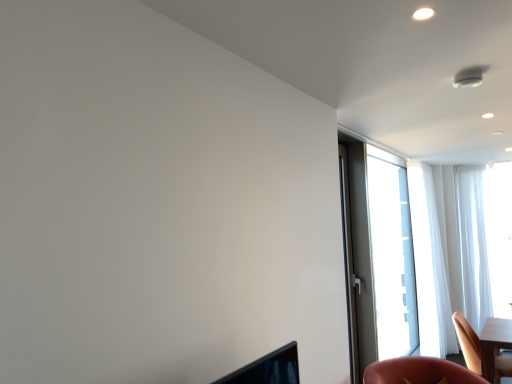
The height and width of the screenshot is (384, 512). Find the location of `wooden chair at lower right`. wooden chair at lower right is located at coordinates (468, 342).

Locate an element on the screen. The image size is (512, 384). white sheer curtain at right, which is the second curtain in right-to-left order is located at coordinates (434, 273).

In order to click on white sheer curtain at right, positioned as the second curtain in left-to-right order in this screenshot , I will do `click(473, 244)`.

From a real-world perspective, is white sheer curtain at right, which is the second curtain in right-to-left order, positioned under transparent glass window at right based on gravity?

Yes, from a real-world perspective, white sheer curtain at right, which is the second curtain in right-to-left order, is beneath transparent glass window at right.

From the picture: What's the angular difference between white sheer curtain at right, which is the second curtain in right-to-left order, and transparent glass window at right's facing directions?

5.79 degrees separate the facing orientations of white sheer curtain at right, which is the second curtain in right-to-left order, and transparent glass window at right.

From the image's perspective, between white sheer curtain at right, arranged as the first curtain when viewed from the left, and transparent glass window at right, which one is located above?

transparent glass window at right, from the image's perspective.

Is white sheer curtain at right, which is the second curtain in right-to-left order, spatially inside transparent glass window at right, or outside of it?

white sheer curtain at right, which is the second curtain in right-to-left order, cannot be found inside transparent glass window at right.

Is the depth of transparent glass window at right greater than that of white sheer curtain at right, arranged as the first curtain when viewed from the left?

No, it is not.

In terms of size, does transparent glass window at right appear bigger or smaller than white sheer curtain at right, arranged as the first curtain when viewed from the left?

Considering their sizes, transparent glass window at right takes up more space than white sheer curtain at right, arranged as the first curtain when viewed from the left.

Consider the image. Considering the relative sizes of transparent glass window at right and white sheer curtain at right, which is the second curtain in right-to-left order, in the image provided, is transparent glass window at right thinner than white sheer curtain at right, which is the second curtain in right-to-left order,?

Correct, the width of transparent glass window at right is less than that of white sheer curtain at right, which is the second curtain in right-to-left order.

Is matte gray screen door at right situated inside white sheer curtain at right, arranged as the first curtain when viewed from the left, or outside?

matte gray screen door at right is spatially situated outside white sheer curtain at right, arranged as the first curtain when viewed from the left.

Between matte gray screen door at right and white sheer curtain at right, arranged as the first curtain when viewed from the left, which one has larger size?

white sheer curtain at right, arranged as the first curtain when viewed from the left, is bigger.

From a real-world perspective, relative to white sheer curtain at right, arranged as the first curtain when viewed from the left, is matte gray screen door at right vertically above or below?

Clearly, from a real-world perspective, matte gray screen door at right is above white sheer curtain at right, arranged as the first curtain when viewed from the left.

Is matte gray screen door at right not near white sheer curtain at right, arranged as the first curtain when viewed from the left?

matte gray screen door at right is positioned a significant distance from white sheer curtain at right, arranged as the first curtain when viewed from the left.

Is white sheer curtain at right, which is the second curtain in right-to-left order, inside the boundaries of white sheer curtain at right, which is counted as the 1th curtain, starting from the right, or outside?

The correct answer is: outside.

The height and width of the screenshot is (384, 512). Find the location of `curtain on the left of white sheer curtain at right, positioned as the second curtain in left-to-right order`. curtain on the left of white sheer curtain at right, positioned as the second curtain in left-to-right order is located at coordinates (434, 273).

Is white sheer curtain at right, arranged as the first curtain when viewed from the left, to the left or to the right of white sheer curtain at right, positioned as the second curtain in left-to-right order, in the image?

white sheer curtain at right, arranged as the first curtain when viewed from the left, is positioned on white sheer curtain at right, positioned as the second curtain in left-to-right order,'s left side.

Looking at this image, from the image's perspective, which is above, white sheer curtain at right, arranged as the first curtain when viewed from the left, or white sheer curtain at right, positioned as the second curtain in left-to-right order?

white sheer curtain at right, positioned as the second curtain in left-to-right order, from the image's perspective.

Can you confirm if transparent glass window at right is shorter than white sheer curtain at right, positioned as the second curtain in left-to-right order?

No.

Considering the relative positions of transparent glass window at right and white sheer curtain at right, positioned as the second curtain in left-to-right order, in the image provided, is transparent glass window at right to the right of white sheer curtain at right, positioned as the second curtain in left-to-right order, from the viewer's perspective?

In fact, transparent glass window at right is to the left of white sheer curtain at right, positioned as the second curtain in left-to-right order.

Who is more distant, transparent glass window at right or white sheer curtain at right, which is counted as the 1th curtain, starting from the right?

white sheer curtain at right, which is counted as the 1th curtain, starting from the right, is further away from the camera.

Is transparent glass window at right aimed at white sheer curtain at right, positioned as the second curtain in left-to-right order?

No, transparent glass window at right is not oriented towards white sheer curtain at right, positioned as the second curtain in left-to-right order.

From a real-world perspective, who is located lower, transparent glass window at right or wooden chair at lower right?

From a 3D spatial view, wooden chair at lower right is below.

Is transparent glass window at right at the right side of wooden chair at lower right?

In fact, transparent glass window at right is to the left of wooden chair at lower right.

Is transparent glass window at right oriented away from wooden chair at lower right?

Yes, transparent glass window at right is positioned with its back facing wooden chair at lower right.

Between wooden chair at lower right and white sheer curtain at right, positioned as the second curtain in left-to-right order, which one has less height?

With less height is wooden chair at lower right.

Considering the points (511, 375) and (488, 314), which point is in front, point (511, 375) or point (488, 314)?

Point (511, 375)

What's the angular difference between wooden chair at lower right and white sheer curtain at right, positioned as the second curtain in left-to-right order,'s facing directions?

The facing directions of wooden chair at lower right and white sheer curtain at right, positioned as the second curtain in left-to-right order, are 91.7 degrees apart.

Does wooden chair at lower right have a greater width compared to white sheer curtain at right, which is counted as the 1th curtain, starting from the right?

Yes.

There is a white sheer curtain at right, which is the second curtain in right-to-left order. At what (x,y) coordinates should I click in order to perform the action: click on window above it (from a real-world perspective). Please return your answer as a coordinate pair (x, y). Looking at the image, I should click on (381, 254).

Where is `curtain below the transparent glass window at right (from the image's perspective)`? Image resolution: width=512 pixels, height=384 pixels. curtain below the transparent glass window at right (from the image's perspective) is located at coordinates (434, 273).

When comparing their distances from white sheer curtain at right, which is the second curtain in right-to-left order, does wooden chair at lower right or transparent glass window at right seem further?

wooden chair at lower right is further to white sheer curtain at right, which is the second curtain in right-to-left order.

From the image, which object appears to be nearer to matte gray screen door at right, transparent glass window at right or white sheer curtain at right, which is the second curtain in right-to-left order?

Based on the image, transparent glass window at right appears to be nearer to matte gray screen door at right.

Looking at the image, which one is located further to white sheer curtain at right, arranged as the first curtain when viewed from the left, transparent glass window at right or white sheer curtain at right, which is counted as the 1th curtain, starting from the right?

Among the two, transparent glass window at right is located further to white sheer curtain at right, arranged as the first curtain when viewed from the left.

From the picture: Considering their positions, is matte gray screen door at right positioned further to wooden chair at lower right than white sheer curtain at right, which is counted as the 1th curtain, starting from the right?

white sheer curtain at right, which is counted as the 1th curtain, starting from the right, lies further to wooden chair at lower right than the other object.

When comparing their distances from white sheer curtain at right, arranged as the first curtain when viewed from the left, does matte gray screen door at right or wooden chair at lower right seem closer?

The object closer to white sheer curtain at right, arranged as the first curtain when viewed from the left, is wooden chair at lower right.

Estimate the real-world distances between objects in this image. Which object is closer to white sheer curtain at right, which is the second curtain in right-to-left order, wooden chair at lower right or white sheer curtain at right, positioned as the second curtain in left-to-right order?

The object closer to white sheer curtain at right, which is the second curtain in right-to-left order, is white sheer curtain at right, positioned as the second curtain in left-to-right order.

From the image, which object appears to be nearer to white sheer curtain at right, which is the second curtain in right-to-left order, white sheer curtain at right, positioned as the second curtain in left-to-right order, or transparent glass window at right?

white sheer curtain at right, positioned as the second curtain in left-to-right order, is closer to white sheer curtain at right, which is the second curtain in right-to-left order.

Looking at the image, which one is located closer to white sheer curtain at right, positioned as the second curtain in left-to-right order, white sheer curtain at right, which is the second curtain in right-to-left order, or matte gray screen door at right?

Based on the image, white sheer curtain at right, which is the second curtain in right-to-left order, appears to be nearer to white sheer curtain at right, positioned as the second curtain in left-to-right order.

Find the location of a particular element. window between matte gray screen door at right and wooden chair at lower right is located at coordinates (381, 254).

Where is `chair between matte gray screen door at right and white sheer curtain at right, which is counted as the 1th curtain, starting from the right, in the horizontal direction`? chair between matte gray screen door at right and white sheer curtain at right, which is counted as the 1th curtain, starting from the right, in the horizontal direction is located at coordinates (468, 342).

This screenshot has width=512, height=384. What are the coordinates of `window between wooden chair at lower right and white sheer curtain at right, which is counted as the 1th curtain, starting from the right, along the z-axis` in the screenshot? It's located at (381, 254).

Image resolution: width=512 pixels, height=384 pixels. In order to click on window between wooden chair at lower right and white sheer curtain at right, arranged as the first curtain when viewed from the left, in the front-back direction in this screenshot , I will do `click(381, 254)`.